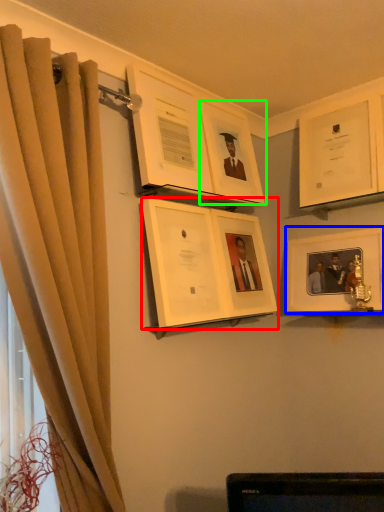
Question: Which is farther away from picture frame (highlighted by a red box)? picture frame (highlighted by a blue box) or picture frame (highlighted by a green box)?

Choices:
 (A) picture frame
 (B) picture frame

Answer: (A)